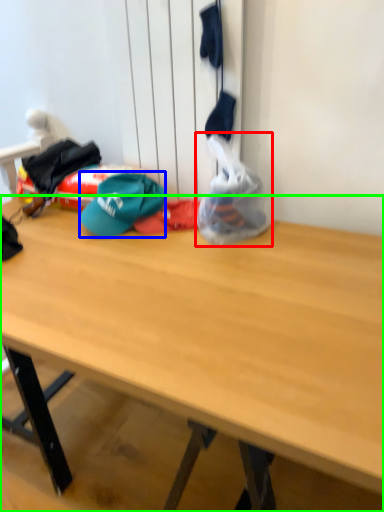
Question: Which object is positioned closest to plastic bag (highlighted by a red box)? Select from hat (highlighted by a blue box) and desk (highlighted by a green box).

Choices:
 (A) hat
 (B) desk

Answer: (A)